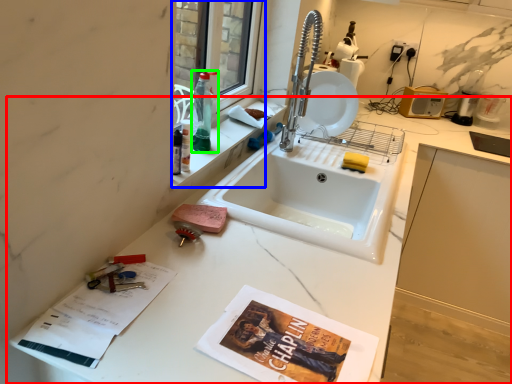
Question: Which object is positioned closest to countertop (highlighted by a red box)? Select from window (highlighted by a blue box) and bottle (highlighted by a green box).

Choices:
 (A) window
 (B) bottle

Answer: (B)